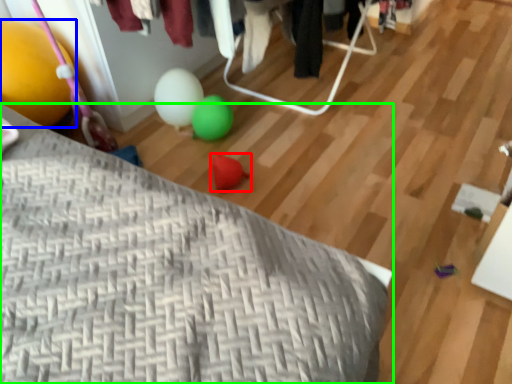
Question: Which is farther away from toy (highlighted by a red box)? balloon (highlighted by a blue box) or furniture (highlighted by a green box)?

Choices:
 (A) balloon
 (B) furniture

Answer: (B)